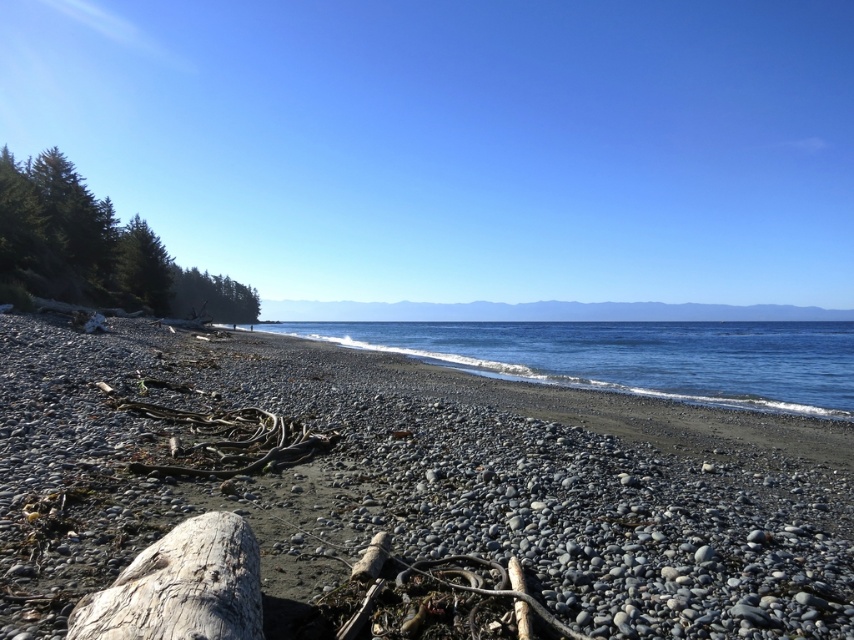
You are standing at the shoreline looking out towards the sea. There are two points marked in the image. One is at coordinate point (817, 358) and the other is at point (97, 300). Which point is closer to you?

Point (817, 358) is closer to you than point (97, 300).

You are standing on the gray pebbled beach at center and want to walk to the green leafy trees at left. Which direction should you face to move towards them?

You should face towards the left direction to move towards the green leafy trees at left from the gray pebbled beach at center.

You are standing on the gray pebbled beach at center and want to walk towards the green leafy trees at left. Which direction should you face to head directly towards them?

You should face towards the left direction because the gray pebbled beach at center is positioned under green leafy trees at left, indicating they are located to your left side.